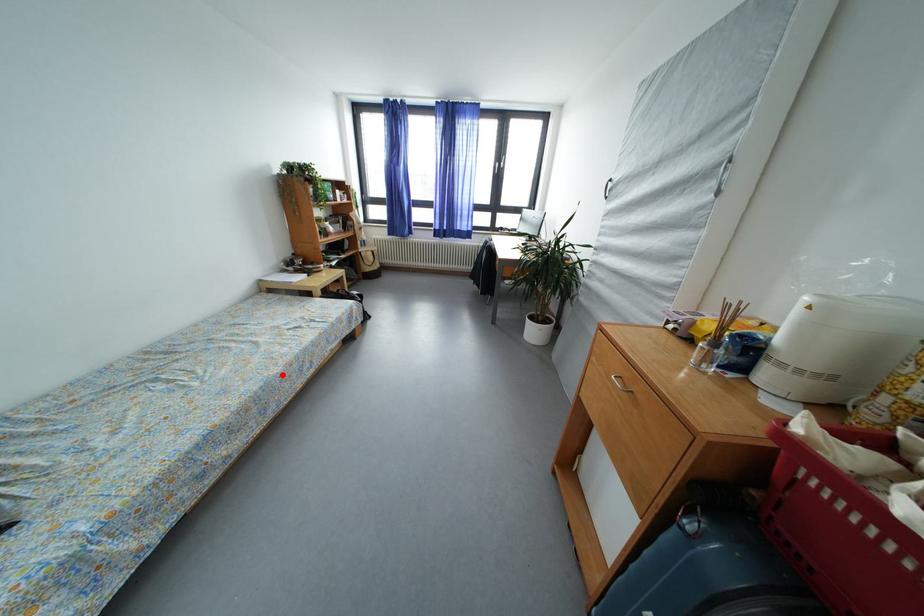
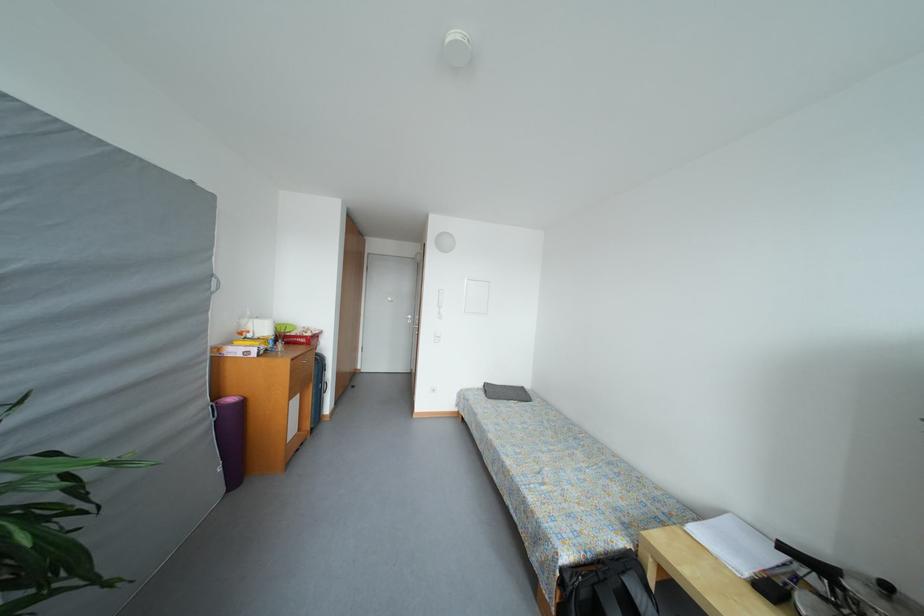
Question: A red point is marked in image1. In image2, is the corresponding 3D point closer to the camera or farther? Reply with the corresponding letter.

Choices:
 (A) The corresponding 3D point is closer.
 (B) The corresponding 3D point is farther.

Answer: (B)